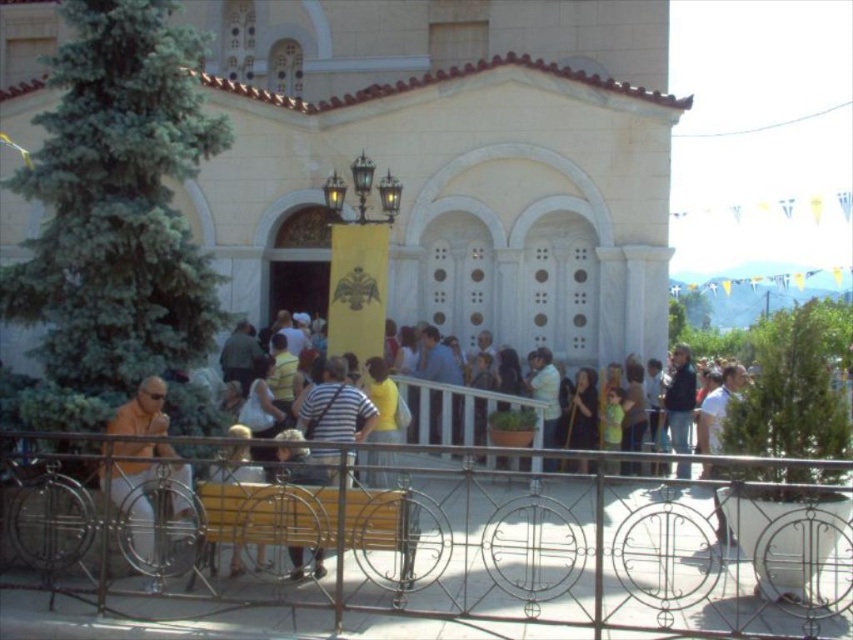
Question: Estimate the real-world distances between objects in this image. Which object is farther from the metallic wrought iron at center?

Choices:
 (A) white marble church at center
 (B) dark gray fabric pants at center
 (C) wooden bench at lower center

Answer: (A)

Question: Is metallic wrought iron at center positioned in front of orange fabric shirt at left?

Choices:
 (A) no
 (B) yes

Answer: (B)

Question: Which object is farther from the camera taking this photo?

Choices:
 (A) metallic wrought iron at center
 (B) white marble church at center

Answer: (B)

Question: Is white marble church at center positioned in front of orange fabric shirt at left?

Choices:
 (A) yes
 (B) no

Answer: (B)

Question: Where is white marble church at center located in relation to orange fabric shirt at left in the image?

Choices:
 (A) left
 (B) right

Answer: (A)

Question: Which point appears closest to the camera in this image?

Choices:
 (A) (448, 36)
 (B) (263, 552)
 (C) (177, 477)
 (D) (318, 477)

Answer: (B)